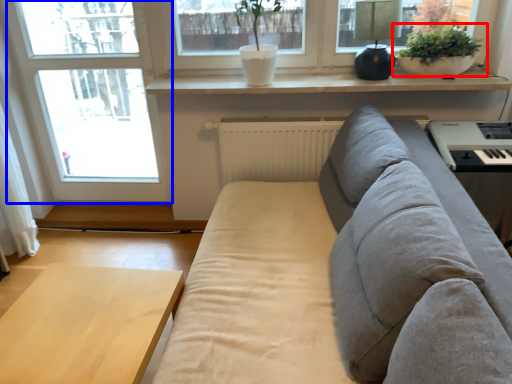
Question: Which point is closer to the camera, houseplant (highlighted by a red box) or window (highlighted by a blue box)?

Choices:
 (A) houseplant
 (B) window

Answer: (A)